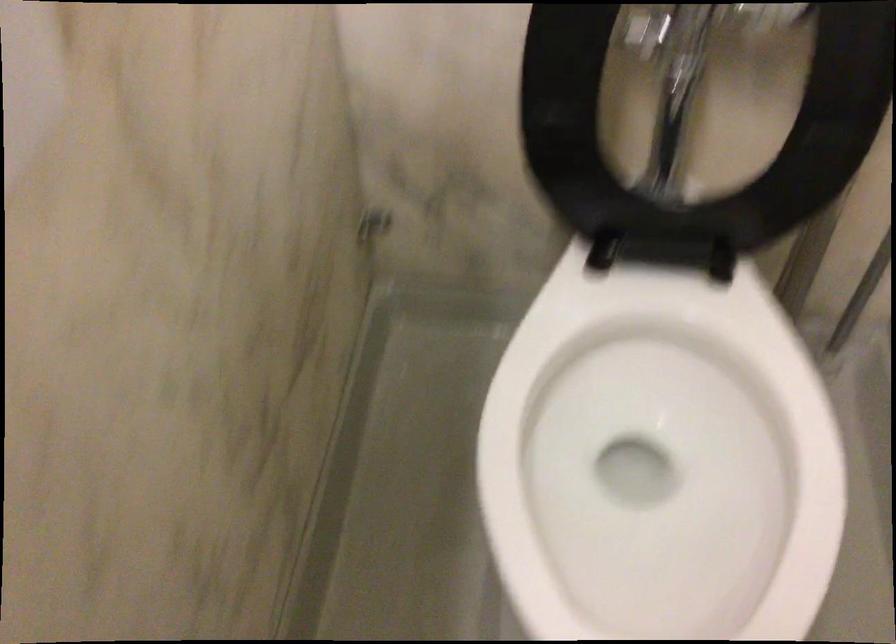
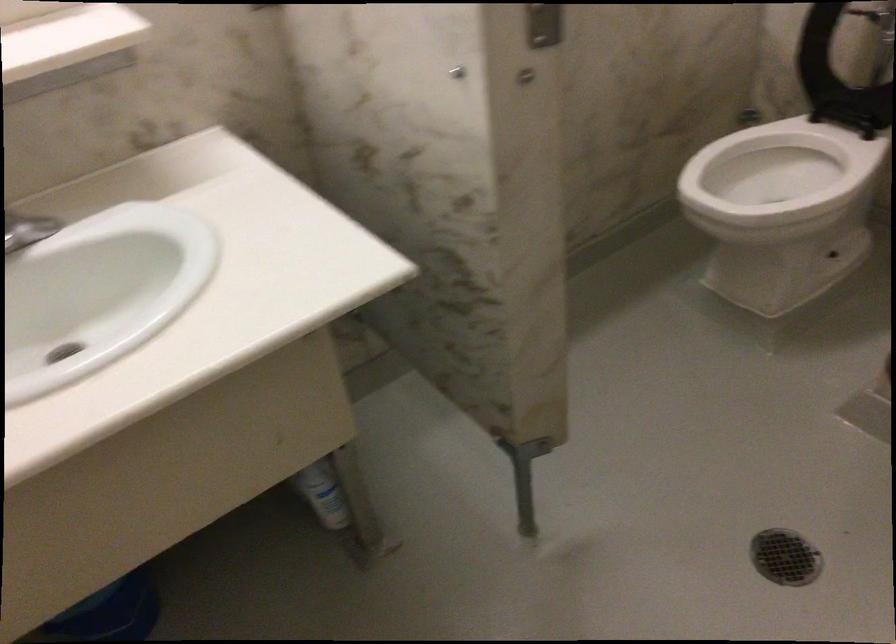
Find the pixel in the second image that matches (x=582, y=384) in the first image.

(778, 173)